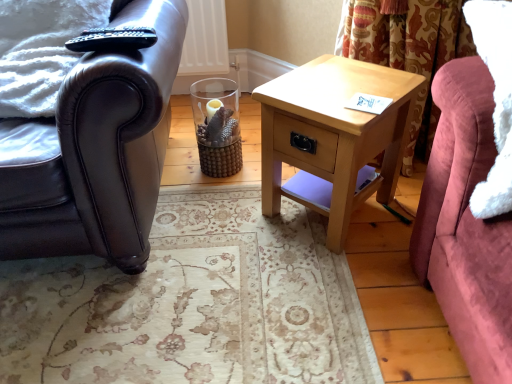
Question: From the image's perspective, is light wood/texture nightstand at center positioned above or below shiny black leather armchair at left?

Choices:
 (A) below
 (B) above

Answer: (A)

Question: Is light wood/texture nightstand at center spatially inside shiny black leather armchair at left, or outside of it?

Choices:
 (A) outside
 (B) inside

Answer: (A)

Question: Estimate the real-world distances between objects in this image. Which object is farther from the shiny black leather armchair at left?

Choices:
 (A) light wood/texture nightstand at center
 (B) velvet pink couch at right

Answer: (B)

Question: Based on their relative distances, which object is farther from the shiny black leather armchair at left?

Choices:
 (A) velvet pink couch at right
 (B) light wood/texture nightstand at center

Answer: (A)